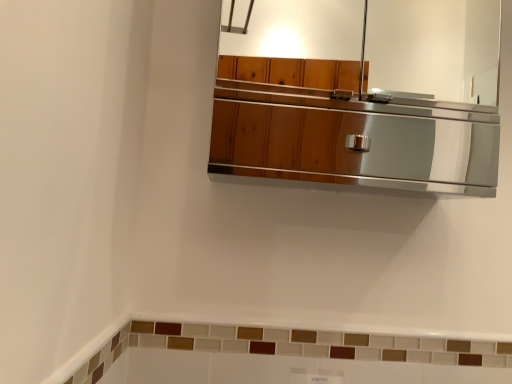
I want to click on silver/metallic mirror at upper center, so click(x=371, y=107).

What do you see at coordinates (371, 107) in the screenshot?
I see `silver/metallic mirror at upper center` at bounding box center [371, 107].

Identify the location of silver/metallic mirror at upper center. 371,107.